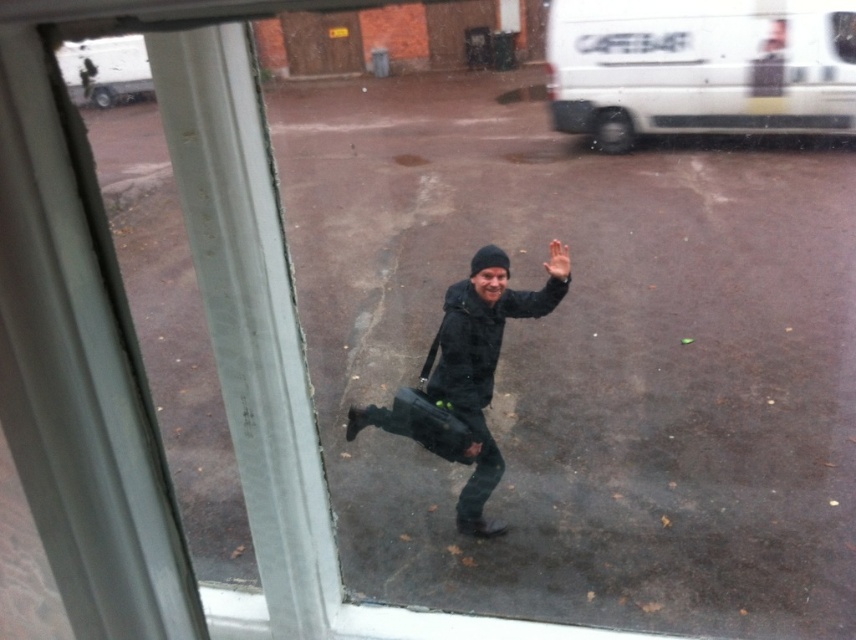
Question: Can you confirm if black matte jacket at center is positioned to the left of brown wooden door at upper center?

Choices:
 (A) yes
 (B) no

Answer: (B)

Question: Based on their relative distances, which object is nearer to the black matte jacket at center?

Choices:
 (A) white matte van at upper right
 (B) matte skin hand at center

Answer: (B)

Question: Is white matte van at upper right thinner than black matte jacket at center?

Choices:
 (A) no
 (B) yes

Answer: (A)

Question: Which point appears closest to the camera in this image?

Choices:
 (A) (446, 323)
 (B) (306, 56)

Answer: (A)

Question: Which of the following is the farthest from the observer?

Choices:
 (A) black matte jacket at center
 (B) white matte van at upper right
 (C) brown wooden door at upper center
 (D) matte skin hand at center

Answer: (C)

Question: Can you confirm if black matte jacket at center is positioned below brown wooden door at upper center?

Choices:
 (A) no
 (B) yes

Answer: (B)